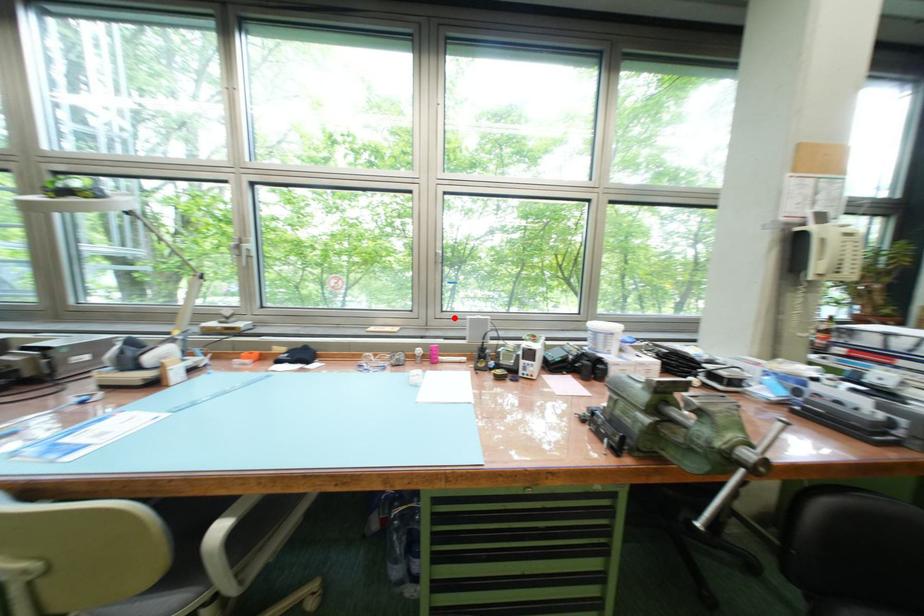
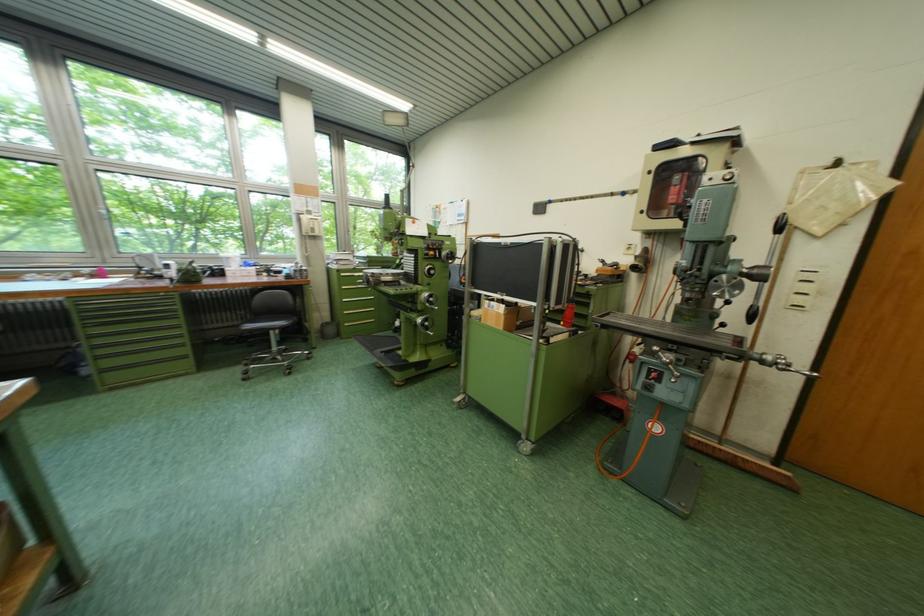
In the second image, find the point that corresponds to the highlighted location in the first image.

(132, 257)